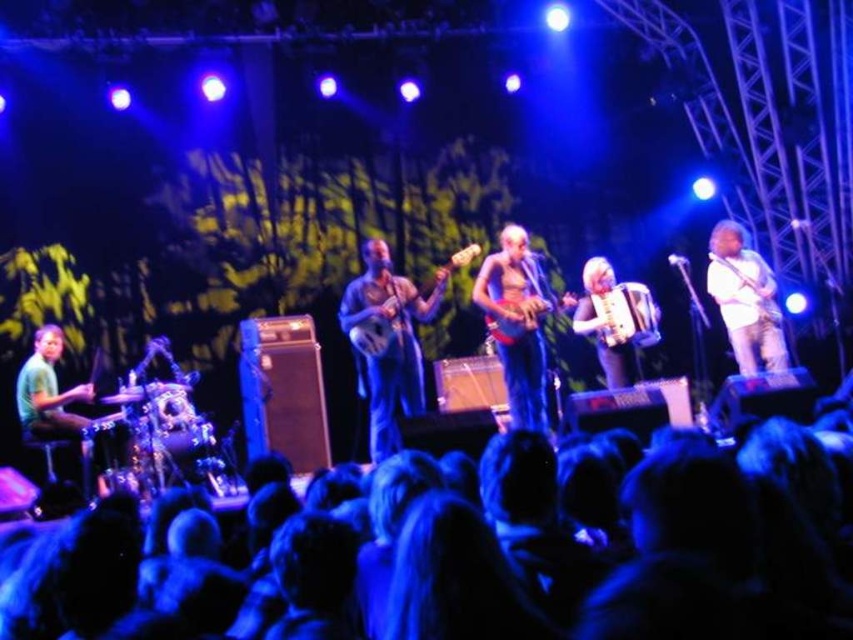
Between point (733, 342) and point (502, 324), which one is positioned in front?

Point (502, 324) is more forward.

Between white matte guitar at right and wooden acoustic guitar at center, which one appears on the right side from the viewer's perspective?

white matte guitar at right is more to the right.

Is point (770, 356) more distant than point (498, 330)?

Yes, point (770, 356) is farther from viewer.

Locate an element on the screen. white matte guitar at right is located at coordinates (746, 300).

Does point (648, 570) come in front of point (608, 291)?

That is True.

Who is higher up, black hair at lower center or wooden percussion instrument at center?

wooden percussion instrument at center

Who is more distant from viewer, (469,628) or (636,317)?

The point (636,317) is more distant.

You are a GUI agent. You are given a task and a screenshot of the screen. Output one action in this format:
    pyautogui.click(x=<x>, y=<y>)
    Task: Click on the black hair at lower center
    
    Given the screenshot: What is the action you would take?
    pyautogui.click(x=701, y=609)

Is shiny blue guitar at center bigger than white matte guitar at right?

Yes, shiny blue guitar at center is bigger than white matte guitar at right.

Can you confirm if shiny blue guitar at center is shorter than white matte guitar at right?

No, shiny blue guitar at center is not shorter than white matte guitar at right.

Does point (503, 310) come in front of point (759, 316)?

Yes, point (503, 310) is closer to viewer.

What are the coordinates of `shiny blue guitar at center` in the screenshot? It's located at (519, 328).